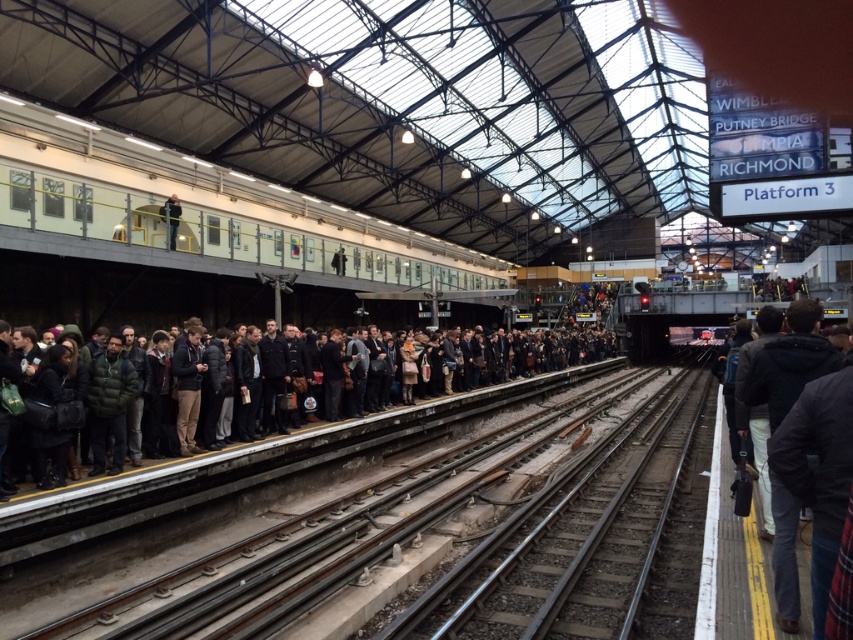
Question: Is smooth concrete track at center closer to the viewer compared to smooth steel tracks at center?

Choices:
 (A) yes
 (B) no

Answer: (A)

Question: Which point appears farthest from the camera in this image?

Choices:
 (A) (190, 600)
 (B) (235, 452)
 (C) (231, 268)
 (D) (619, 468)

Answer: (C)

Question: Which of the following is the closest to the observer?

Choices:
 (A) metallic silver train at upper center
 (B) smooth steel tracks at center

Answer: (B)

Question: Does smooth steel tracks at center have a larger size compared to dark gray clothing at center?

Choices:
 (A) yes
 (B) no

Answer: (B)

Question: Considering the real-world distances, which object is farthest from the dark gray clothing at center?

Choices:
 (A) smooth steel tracks at center
 (B) smooth concrete track at center
 (C) metallic silver train at upper center

Answer: (C)

Question: Considering the relative positions of metallic silver train at upper center and smooth concrete track at center in the image provided, where is metallic silver train at upper center located with respect to smooth concrete track at center?

Choices:
 (A) right
 (B) left

Answer: (B)